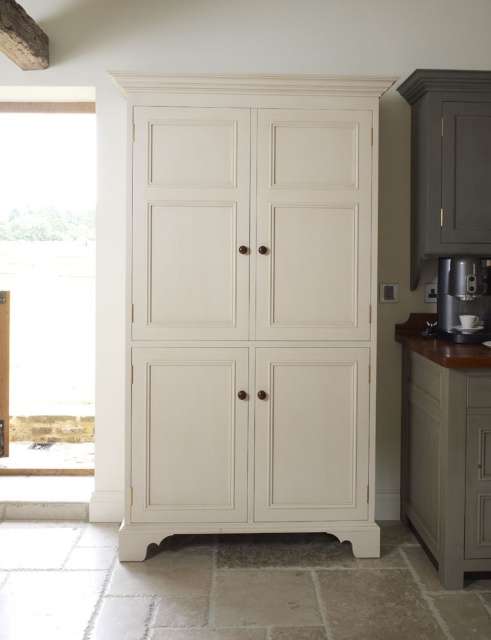
Who is higher up, matte cream cabinet at center or wooden textured exhaust hood at upper left?

wooden textured exhaust hood at upper left

Does matte cream cabinet at center appear on the left side of wooden textured exhaust hood at upper left?

In fact, matte cream cabinet at center is to the right of wooden textured exhaust hood at upper left.

Does point (219, 316) lie in front of point (0, 10)?

No, (219, 316) is behind (0, 10).

Find the location of a particular element. This screenshot has width=491, height=640. matte cream cabinet at center is located at coordinates (251, 307).

Can you confirm if satin silver metallic coffee machine at right is positioned to the left of wooden textured exhaust hood at upper left?

In fact, satin silver metallic coffee machine at right is to the right of wooden textured exhaust hood at upper left.

Does satin silver metallic coffee machine at right appear over wooden textured exhaust hood at upper left?

Incorrect, satin silver metallic coffee machine at right is not positioned above wooden textured exhaust hood at upper left.

Identify the location of satin silver metallic coffee machine at right. (463, 296).

Does matte cream cabinet at center have a larger size compared to satin silver metallic coffee machine at right?

Yes.

Describe the element at coordinates (251, 307) in the screenshot. I see `matte cream cabinet at center` at that location.

Between point (237, 346) and point (468, 337), which one is positioned behind?

The point (468, 337) is more distant.

At what (x,y) coordinates should I click in order to perform the action: click on matte cream cabinet at center. Please return your answer as a coordinate pair (x, y). Looking at the image, I should click on (251, 307).